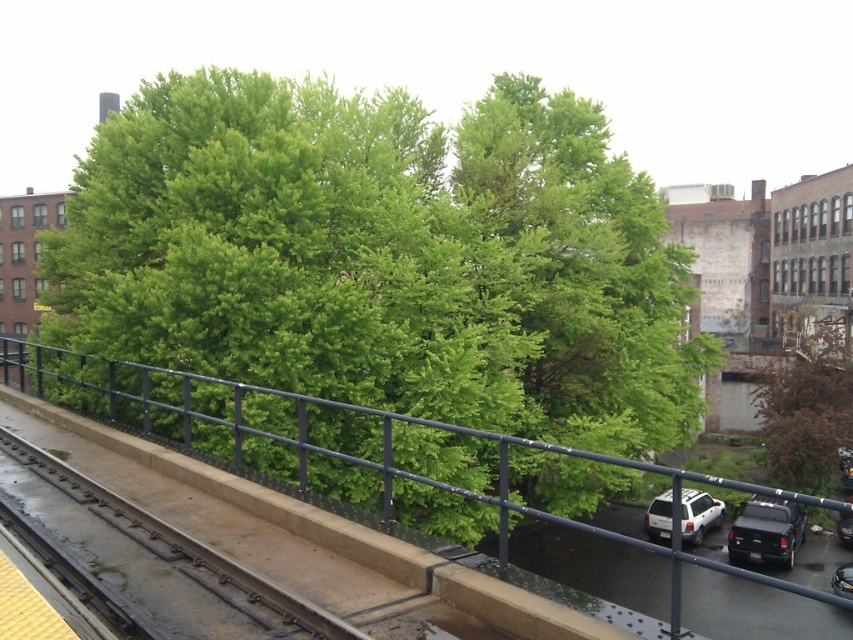
Question: Is brown textured tree at lower right thinner than white matte suv at lower right?

Choices:
 (A) no
 (B) yes

Answer: (A)

Question: Can you confirm if green leafy tree at center is positioned above smooth concrete train track at lower left?

Choices:
 (A) no
 (B) yes

Answer: (B)

Question: Based on their relative distances, which object is nearer to the black metal rail at center?

Choices:
 (A) smooth concrete train track at lower left
 (B) shiny black car at lower right

Answer: (B)

Question: Which of the following is the farthest from the observer?

Choices:
 (A) (791, 321)
 (B) (448, 460)
 (C) (724, 572)
 (D) (762, 560)

Answer: (A)

Question: Which point is closer to the camera?

Choices:
 (A) [x=276, y=442]
 (B) [x=815, y=339]

Answer: (A)

Question: Does green leafy tree at center have a smaller size compared to smooth concrete train track at lower left?

Choices:
 (A) no
 (B) yes

Answer: (A)